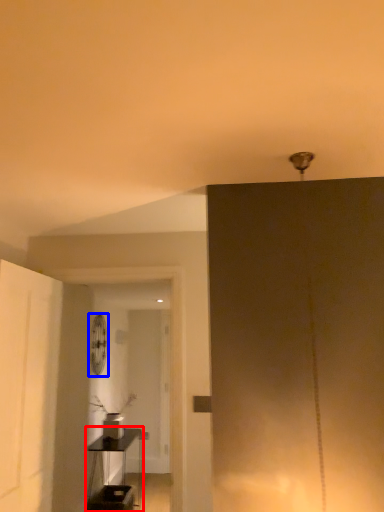
Question: Among these objects, which one is nearest to the camera, table (highlighted by a red box) or fan (highlighted by a blue box)?

Choices:
 (A) table
 (B) fan

Answer: (A)